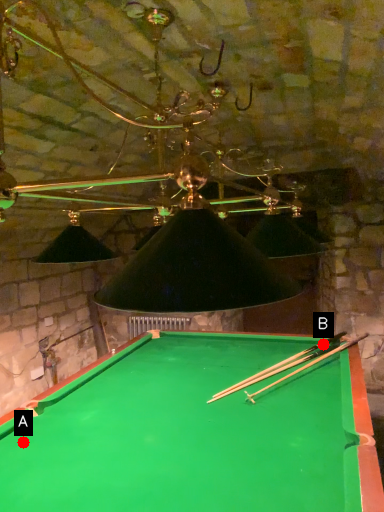
Question: Two points are circled on the image, labeled by A and B beside each circle. Which of the following is the closest to the observer?

Choices:
 (A) A is closer
 (B) B is closer

Answer: (A)